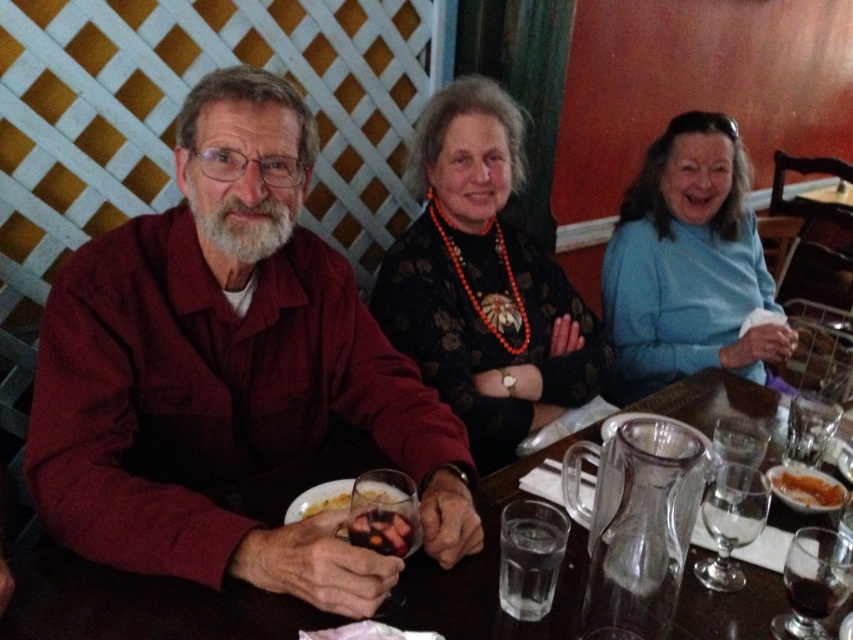
Question: Which object is positioned farthest from the black floral dress at center?

Choices:
 (A) dark brown glossy food at lower center
 (B) translucent glass wine at lower left
 (C) yellowish matte plate at lower center

Answer: (A)

Question: Among these points, which one is nearest to the camera?

Choices:
 (A) (809, 472)
 (B) (78, 371)
 (C) (293, 518)
 (D) (509, 227)

Answer: (B)

Question: Observing the image, what is the correct spatial positioning of maroon shirt at left in reference to clear glass pitcher at center?

Choices:
 (A) above
 (B) below

Answer: (A)

Question: Is dark brown glossy food at lower center further to the viewer compared to smooth white bread at lower right?

Choices:
 (A) no
 (B) yes

Answer: (A)

Question: Which point is farther from the camera taking this photo?

Choices:
 (A) (286, 516)
 (B) (305, 506)

Answer: (B)

Question: Does blue soft sweater at upper right have a lesser width compared to smooth white bread at lower right?

Choices:
 (A) yes
 (B) no

Answer: (B)